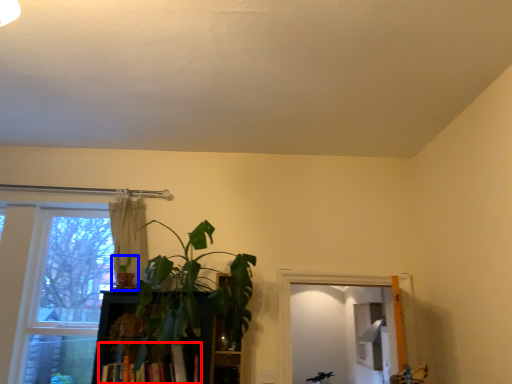
Question: Which object is closer to the camera taking this photo, book (highlighted by a red box) or houseplant (highlighted by a blue box)?

Choices:
 (A) book
 (B) houseplant

Answer: (A)